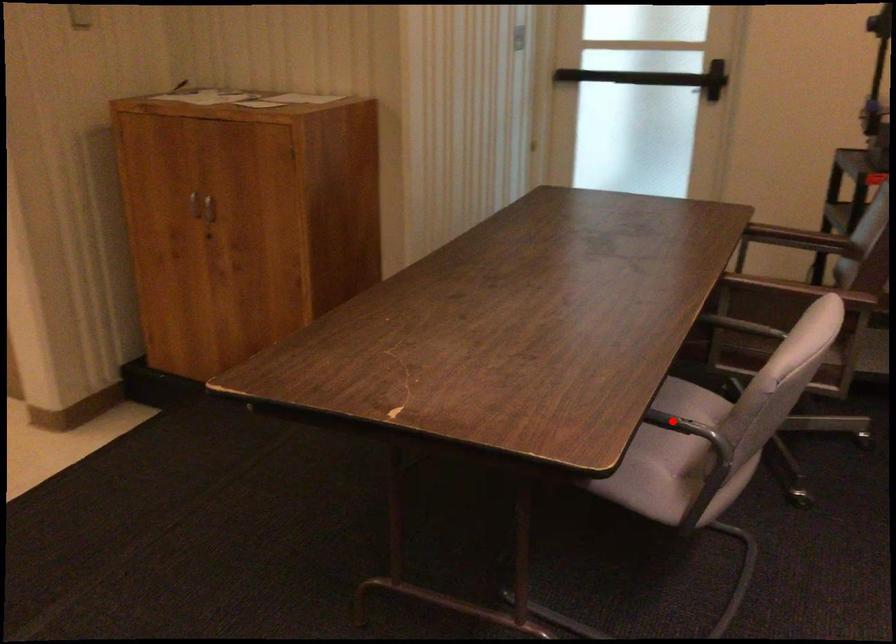
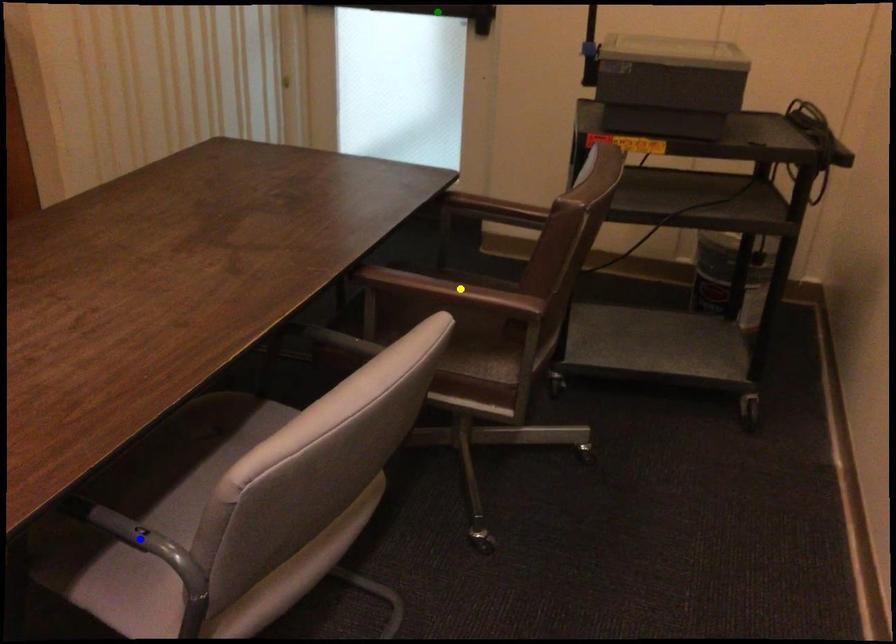
Question: I am providing you with two images of the same scene from different viewpoints. A red point is marked on the first image. You are given multiple points on the second image. Which spot in image 2 lines up with the point in image 1?

Choices:
 (A) blue point
 (B) yellow point
 (C) green point

Answer: (A)